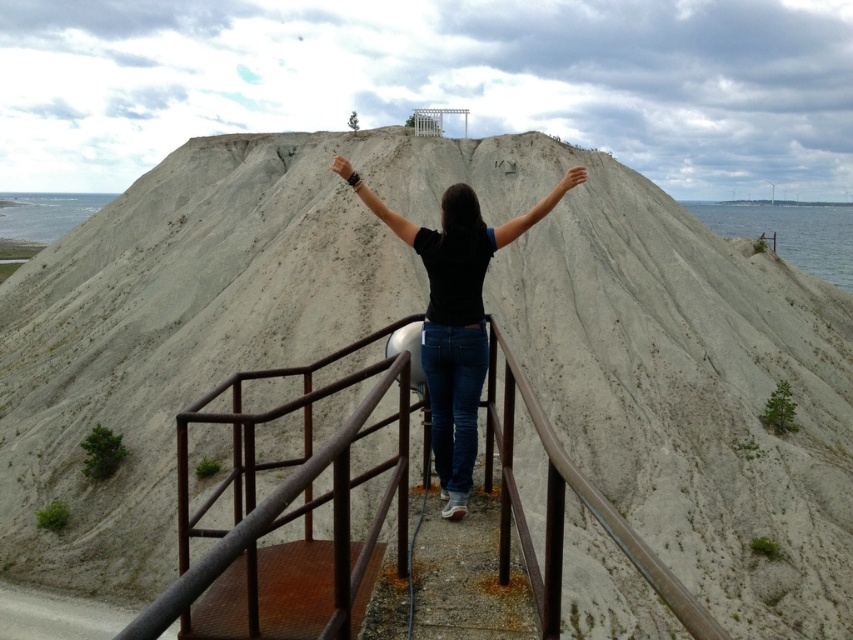
Between blue water at lower right and matte black hand at upper center, which one appears on the right side from the viewer's perspective?

blue water at lower right

Is blue water at lower right positioned in front of matte black hand at upper center?

That is False.

Between point (799, 268) and point (335, 156), which one is positioned in front?

Point (335, 156) is in front.

In order to click on blue water at lower right in this screenshot , I will do `click(790, 232)`.

Is point (248, 536) closer to camera compared to point (44, 216)?

Yes, it is.

What are the coordinates of `rusty metal railing at center` in the screenshot? It's located at (286, 516).

The height and width of the screenshot is (640, 853). Identify the location of rusty metal railing at center. (286, 516).

Find the location of a particular element. Image resolution: width=853 pixels, height=640 pixels. blue water at lower left is located at coordinates (45, 212).

Does blue water at lower left appear over light skin hand at upper center?

Indeed, blue water at lower left is positioned over light skin hand at upper center.

Identify the location of blue water at lower left. (45, 212).

Identify the location of blue water at lower left. (45, 212).